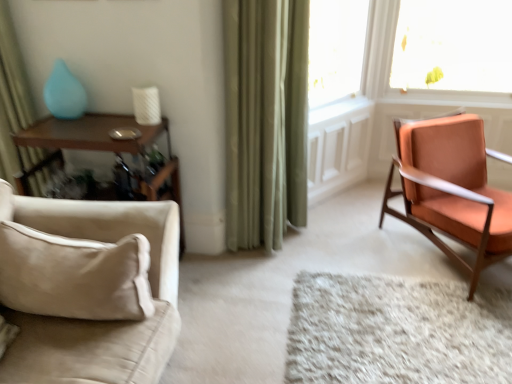
Question: Is point pos(350,334) positioned closer to the camera than point pos(256,102)?

Choices:
 (A) farther
 (B) closer

Answer: (B)

Question: From a real-world perspective, relative to green velvet curtain at center, acting as the 1th curtain starting from the right, is white shag rug at center vertically above or below?

Choices:
 (A) below
 (B) above

Answer: (A)

Question: Which of these objects is positioned closest to the matte ceramic vase at upper left?

Choices:
 (A) green velvet curtain at center, which is the second curtain from left to right
 (B) white shag rug at center
 (C) transparent glass window at upper right
 (D) orange fabric chair at right, the 1th chair positioned from the back
 (E) woodenmaterial/texturetable at left

Answer: (E)

Question: Which object is the farthest from the orange fabric chair at right, which ranks as the 2th chair in front-to-back order?

Choices:
 (A) white shag rug at center
 (B) woodenmaterial/texturetable at left
 (C) beige fabric couch at lower left, which is the first chair in front-to-back order
 (D) green fabric curtain at left, which is counted as the 1th curtain, starting from the left
 (E) green velvet curtain at center, which is the second curtain from left to right

Answer: (D)